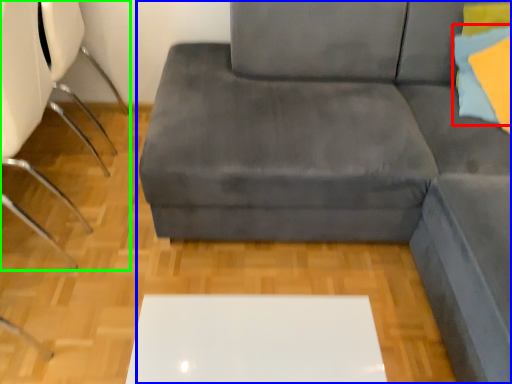
Question: Based on their relative distances, which object is nearer to pillow (highlighted by a red box)? Choose from studio couch (highlighted by a blue box) and chair (highlighted by a green box).

Choices:
 (A) studio couch
 (B) chair

Answer: (A)